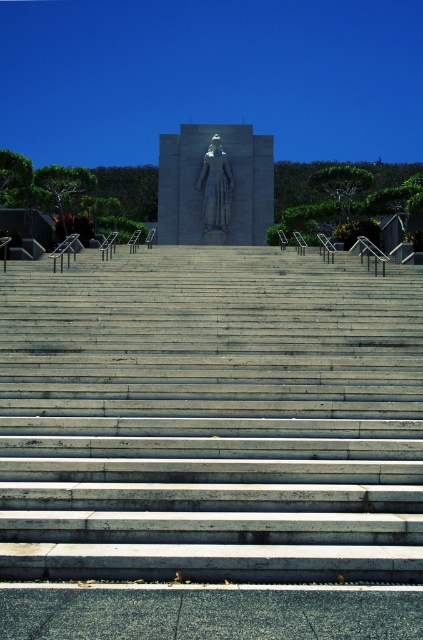
Question: Which object appears closest to the camera in this image?

Choices:
 (A) gray stone statue at center
 (B) polished stone statue at center

Answer: (B)

Question: Among these points, which one is farthest from the camera?

Choices:
 (A) (230, 216)
 (B) (11, 333)
 (C) (159, 152)

Answer: (C)

Question: Does gray concrete stairs at center appear on the left side of polished stone statue at center?

Choices:
 (A) yes
 (B) no

Answer: (B)

Question: Which point is farther to the camera?

Choices:
 (A) polished stone statue at center
 (B) gray stone statue at center
 (C) gray concrete stairs at center

Answer: (B)

Question: Observing the image, what is the correct spatial positioning of gray concrete stairs at center in reference to polished stone statue at center?

Choices:
 (A) above
 (B) below

Answer: (B)

Question: Is gray concrete stairs at center positioned in front of polished stone statue at center?

Choices:
 (A) no
 (B) yes

Answer: (B)